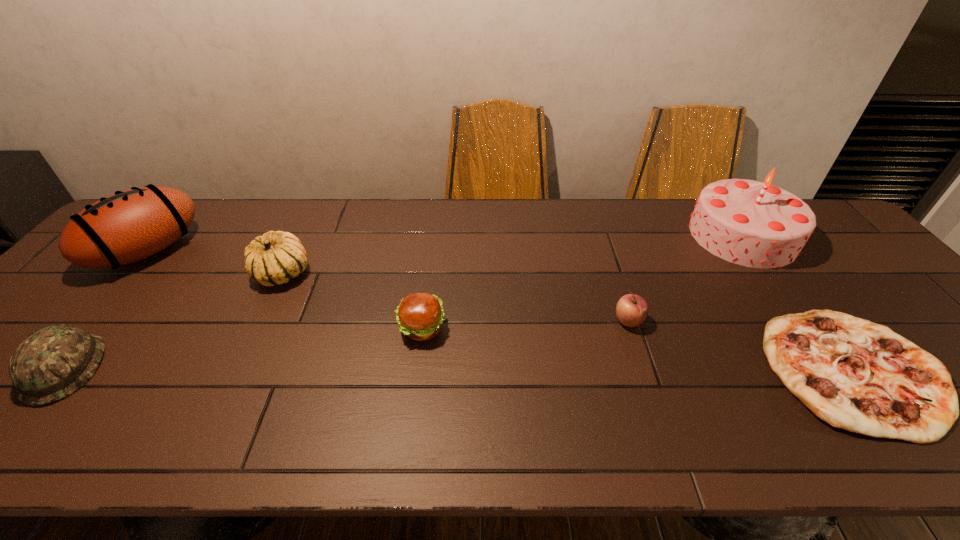
The height and width of the screenshot is (540, 960). Find the location of `free space located on the back of the apple`. free space located on the back of the apple is located at coordinates (615, 283).

Find the location of a particular element. The width and height of the screenshot is (960, 540). birthday cake present at the far edge is located at coordinates (754, 224).

The image size is (960, 540). Identify the location of football (American) located at the far edge. (128, 226).

At what (x,y) coordinates should I click in order to perform the action: click on object at the left edge. Please return your answer as a coordinate pair (x, y). This screenshot has width=960, height=540. Looking at the image, I should click on (128, 226).

You are a GUI agent. You are given a task and a screenshot of the screen. Output one action in this format:
    pyautogui.click(x=<x>, y=<y>)
    Task: Click on the object that is at the right edge
    The width and height of the screenshot is (960, 540).
    Given the screenshot: What is the action you would take?
    pyautogui.click(x=754, y=224)

Identify the location of object that is at the far left corner. (128, 226).

Image resolution: width=960 pixels, height=540 pixels. I want to click on object at the far right corner, so click(754, 224).

I want to click on vacant space at the far edge, so click(x=649, y=219).

Where is `blank area at the near edge`? The height and width of the screenshot is (540, 960). blank area at the near edge is located at coordinates (252, 441).

Locate an element on the screen. This screenshot has height=540, width=960. vacant area at the right edge is located at coordinates (890, 302).